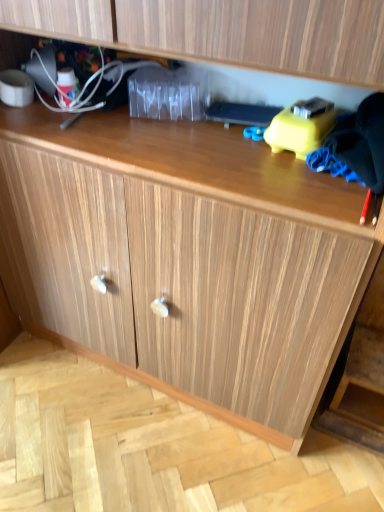
Question: Looking at their shapes, would you say black fabric at right is wider or thinner than yellow plastic toy at upper right?

Choices:
 (A) wide
 (B) thin

Answer: (A)

Question: Considering their positions, is black fabric at right located in front of or behind yellow plastic toy at upper right?

Choices:
 (A) front
 (B) behind

Answer: (A)

Question: Is black fabric at right taller or shorter than yellow plastic toy at upper right?

Choices:
 (A) short
 (B) tall

Answer: (B)

Question: Choose the correct answer: Is yellow plastic toy at upper right inside black fabric at right or outside it?

Choices:
 (A) outside
 (B) inside

Answer: (A)

Question: In terms of height, does yellow plastic toy at upper right look taller or shorter compared to black fabric at right?

Choices:
 (A) tall
 (B) short

Answer: (B)

Question: Looking at their shapes, would you say yellow plastic toy at upper right is wider or thinner than black fabric at right?

Choices:
 (A) wide
 (B) thin

Answer: (B)

Question: From the image's perspective, is yellow plastic toy at upper right located above or below black fabric at right?

Choices:
 (A) above
 (B) below

Answer: (A)